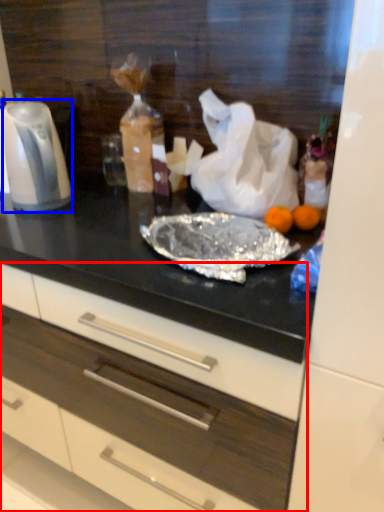
Question: Which object appears farthest to the camera in this image, drawer (highlighted by a red box) or kitchen appliance (highlighted by a blue box)?

Choices:
 (A) drawer
 (B) kitchen appliance

Answer: (B)